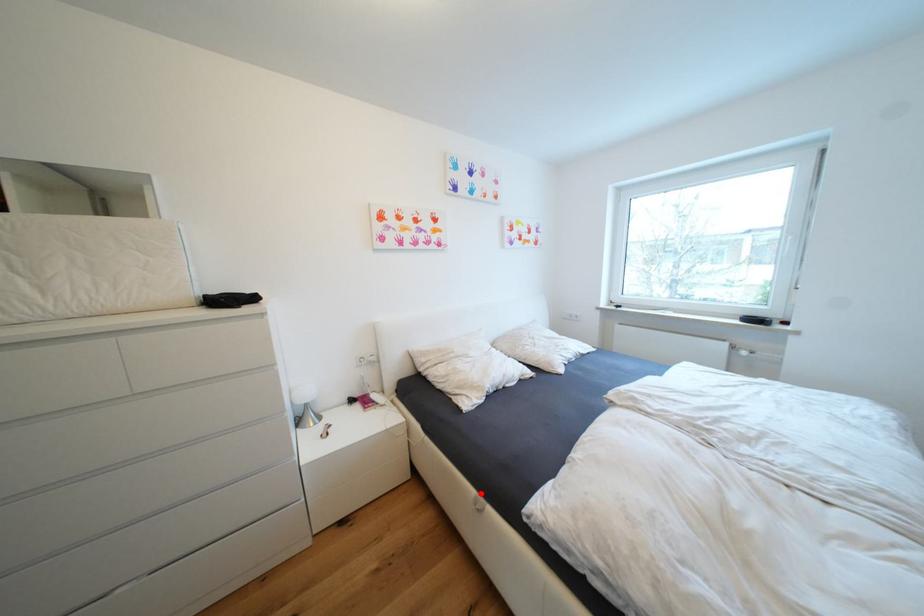
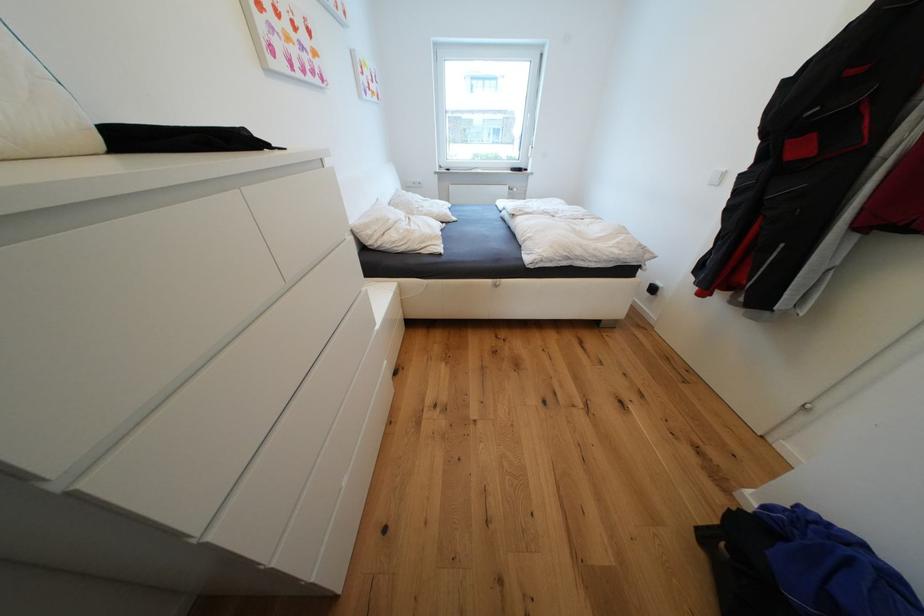
Where in the second image is the point corresponding to the highlighted location from the first image?

(496, 282)